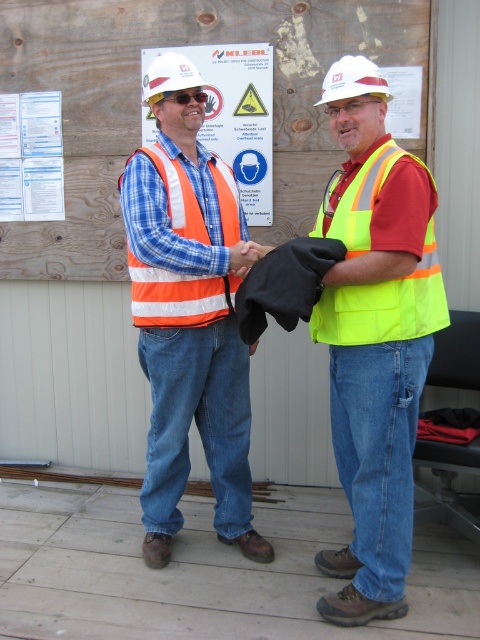
You are a safety inspector who needs to ensure that the reflective plastic sign at upper center and the white paper at upper left are placed at least 70 centimeters apart for visibility. Based on the scene described, are they compliant with this requirement?

The distance between the reflective plastic sign at upper center and the white paper at upper left is 67.44 centimeters, which is less than the required 70 centimeters. Therefore, they are not compliant with the visibility requirement.

You are a safety inspector checking the equipment layout on the deck. You notice the orange reflective safety vest at center and the white hard hat at center. Which object is wider?

The orange reflective safety vest at center is wider than the white hard hat at center.

You are a safety inspector observing two workers on a deck. You notice the orange reflective safety vest at center and the white paper at upper center. Which object is located to the left of the other?

The orange reflective safety vest at center is positioned on the left side of white paper at upper center.